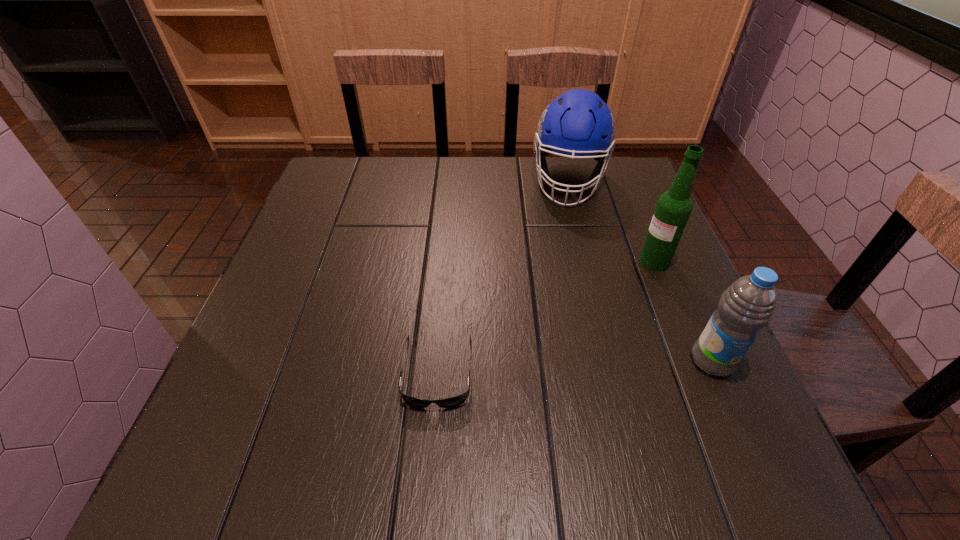
Where is `vacant space on the desktop that is between the shortest object and the water bottle and is positioned on the label of the second farthest object`? vacant space on the desktop that is between the shortest object and the water bottle and is positioned on the label of the second farthest object is located at coordinates (538, 367).

Where is `vacant space on the desktop that is between the shortest object and the water bottle and is positioned on the face guard of the farthest object`? The width and height of the screenshot is (960, 540). vacant space on the desktop that is between the shortest object and the water bottle and is positioned on the face guard of the farthest object is located at coordinates (547, 367).